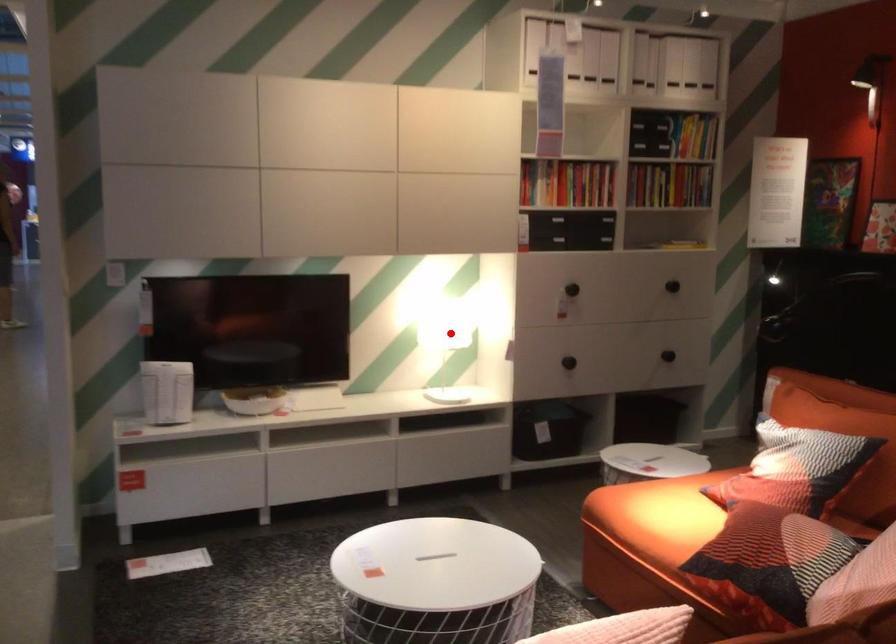
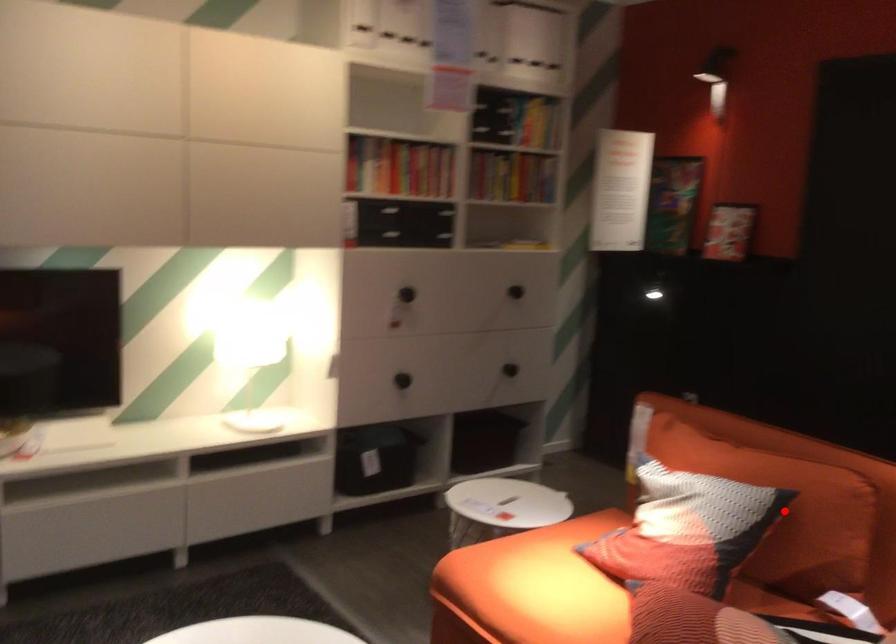
From the picture: I am providing you with two images of the same scene from different viewpoints. A red point is marked on the first image and another point is marked on the second image. Are the points marked in image1 and image2 representing the same 3D position?

No